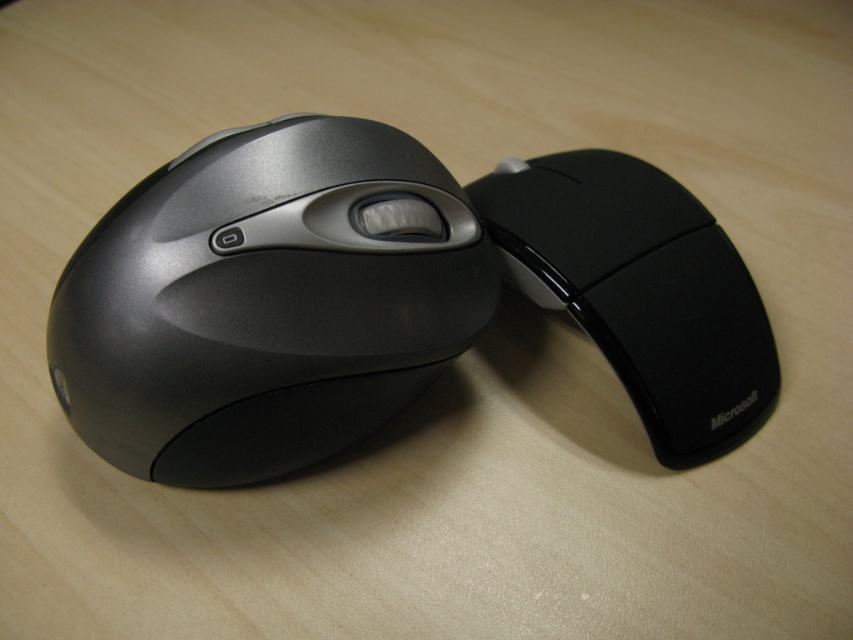
Question: Can you confirm if satin black mouse at center is positioned above black rubberized mouse at right?

Choices:
 (A) yes
 (B) no

Answer: (B)

Question: Considering the relative positions of satin black mouse at center and black rubberized mouse at right in the image provided, where is satin black mouse at center located with respect to black rubberized mouse at right?

Choices:
 (A) right
 (B) left

Answer: (B)

Question: Can you confirm if satin black mouse at center is positioned to the left of black rubberized mouse at right?

Choices:
 (A) no
 (B) yes

Answer: (B)

Question: Which of the following is the closest to the observer?

Choices:
 (A) (154, 186)
 (B) (682, 369)

Answer: (A)

Question: Which point is closer to the camera?

Choices:
 (A) satin black mouse at center
 (B) black rubberized mouse at right

Answer: (A)

Question: Which point is farther from the camera taking this photo?

Choices:
 (A) (419, 221)
 (B) (714, 221)

Answer: (B)